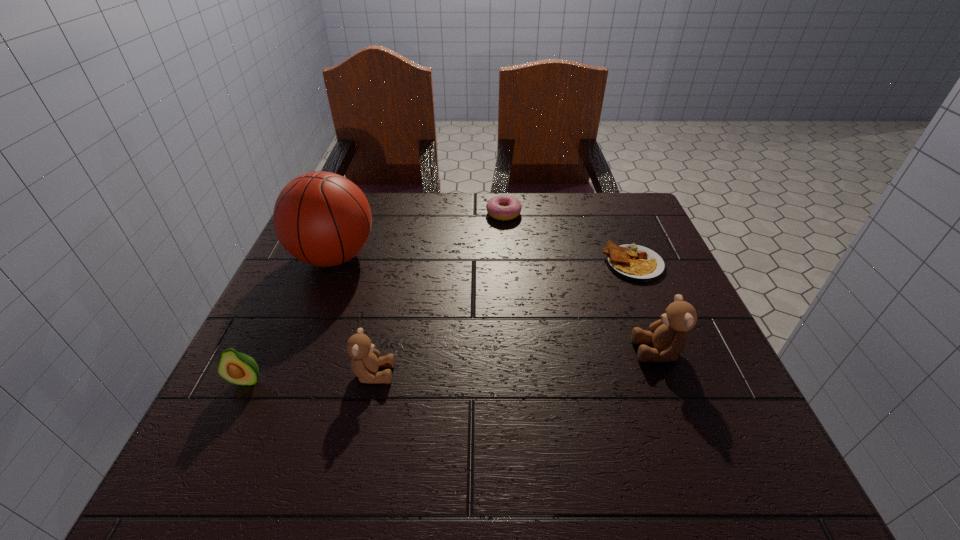
Where is `the third object from left to right`? the third object from left to right is located at coordinates [365, 362].

You are a GUI agent. You are given a task and a screenshot of the screen. Output one action in this format:
    pyautogui.click(x=<x>, y=<y>)
    Task: Click on the left teddy bear
    The width and height of the screenshot is (960, 540).
    Given the screenshot: What is the action you would take?
    pyautogui.click(x=365, y=362)

This screenshot has width=960, height=540. In order to click on the taller teddy bear in this screenshot , I will do `click(669, 335)`.

The image size is (960, 540). Find the location of `the fifth shortest object`. the fifth shortest object is located at coordinates (669, 335).

This screenshot has width=960, height=540. I want to click on the farthest object, so click(x=502, y=207).

At what (x,y) coordinates should I click in order to perform the action: click on the third object from right to left. Please return your answer as a coordinate pair (x, y). This screenshot has width=960, height=540. Looking at the image, I should click on (502, 207).

Find the location of a particular element. the tallest object is located at coordinates (323, 219).

I want to click on the shortest object, so click(x=632, y=262).

Find the location of a particular element. avocado is located at coordinates (238, 368).

What are the coordinates of `vacant space positioned 0.270m on the face of the third object from left to right` in the screenshot? It's located at pyautogui.click(x=540, y=374).